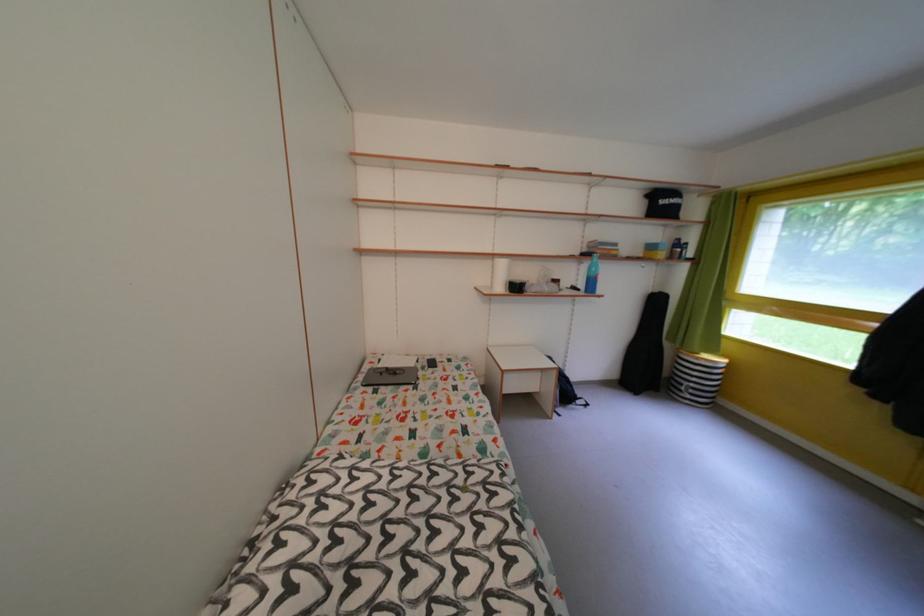
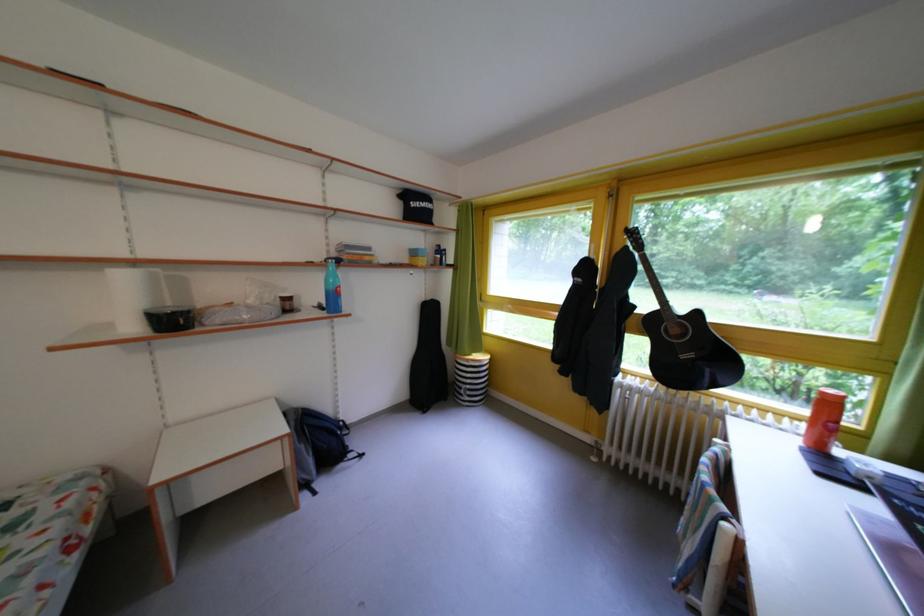
Question: I am providing you with two images of the same scene from different viewpoints. Please identify which objects are invisible in image2.

Choices:
 (A) black bowl
 (B) blue water bottle
 (C) paper towel roll
 (D) none of these

Answer: (D)